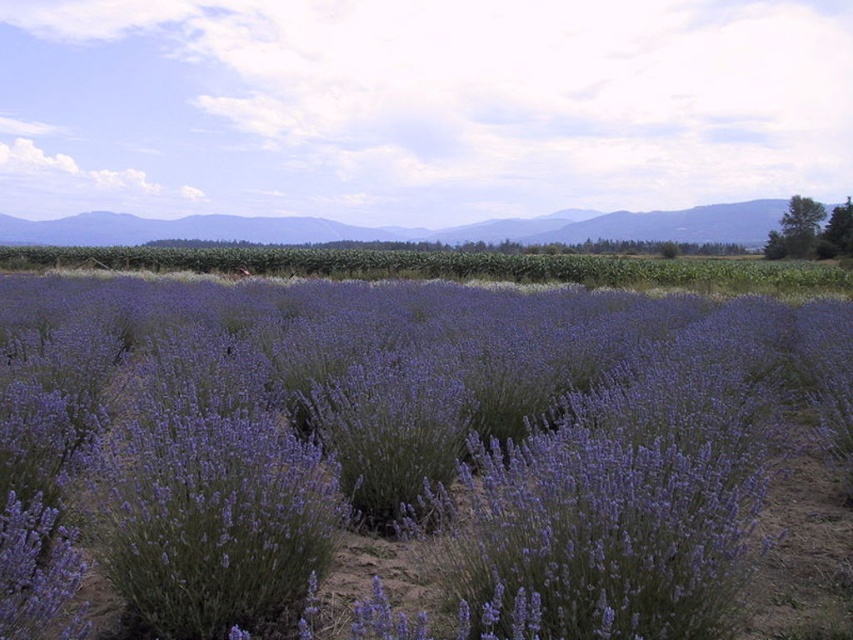
You are a landscape photographer planning to capture the lavender field and the distant mountains in a single shot. Based on the scene, which object, the purple soft lavender at center or the smooth green mountains at upper center, will appear closer to the camera in your photograph?

The purple soft lavender at center will appear closer to the camera because it is not as tall as the smooth green mountains at upper center, making it seem nearer in the photograph.

You are planning to plant a new row of lavender plants between the purple soft lavender at center and the smooth green mountains at upper center. Given their widths, which area should you choose to ensure the new row fits without overcrowding?

The purple soft lavender at center has a lesser width compared to the smooth green mountains at upper center. Therefore, you should plant the new row near the purple soft lavender at center since it has more available space.

You are an artist painting the lavender field scene. You want to ensure the purple soft lavender at center and the smooth green mountains at upper center are proportionally accurate. Based on their sizes in the image, which object should you paint smaller?

The purple soft lavender at center should be painted smaller because it is smaller than the smooth green mountains at upper center in the image.